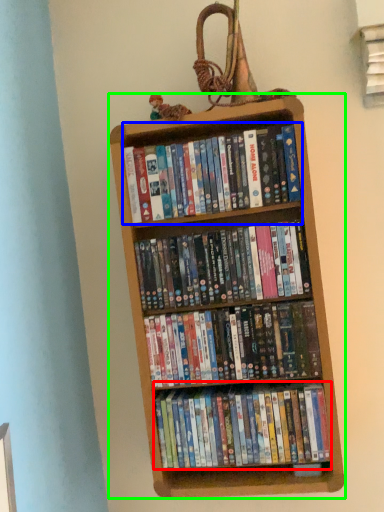
Question: Which object is positioned farthest from book (highlighted by a red box)? Select from book (highlighted by a blue box) and bookcase (highlighted by a green box).

Choices:
 (A) book
 (B) bookcase

Answer: (A)